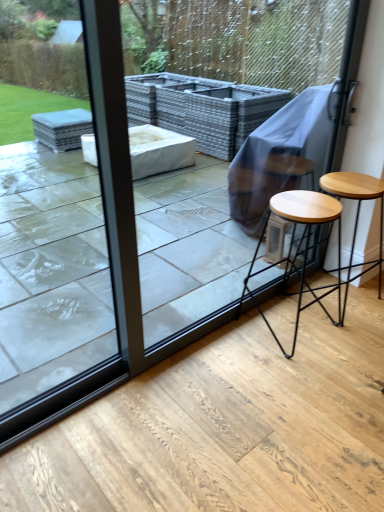
The height and width of the screenshot is (512, 384). I want to click on vacant point above light brown wood stool at lower right, the 1th stool when ordered from left to right (from a real-world perspective), so click(x=307, y=206).